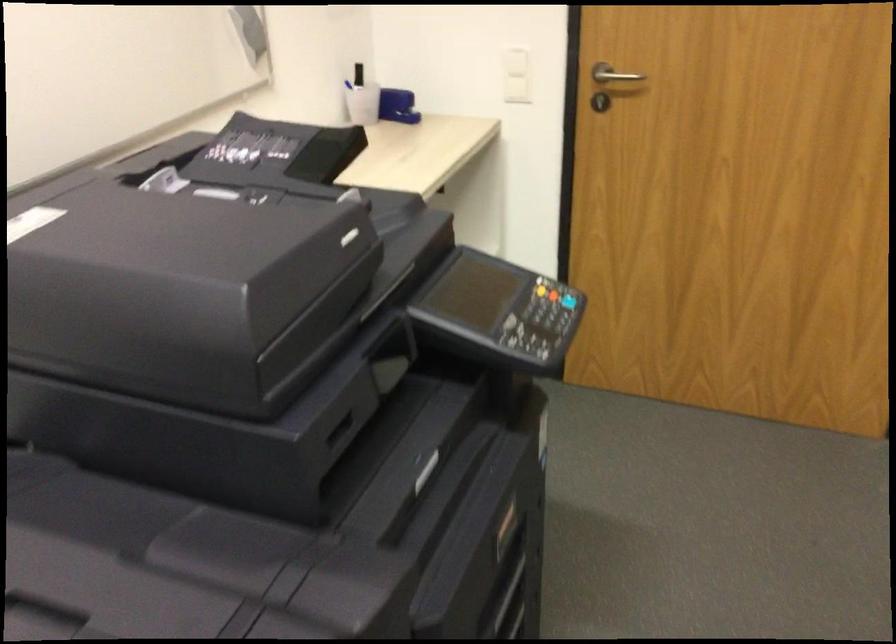
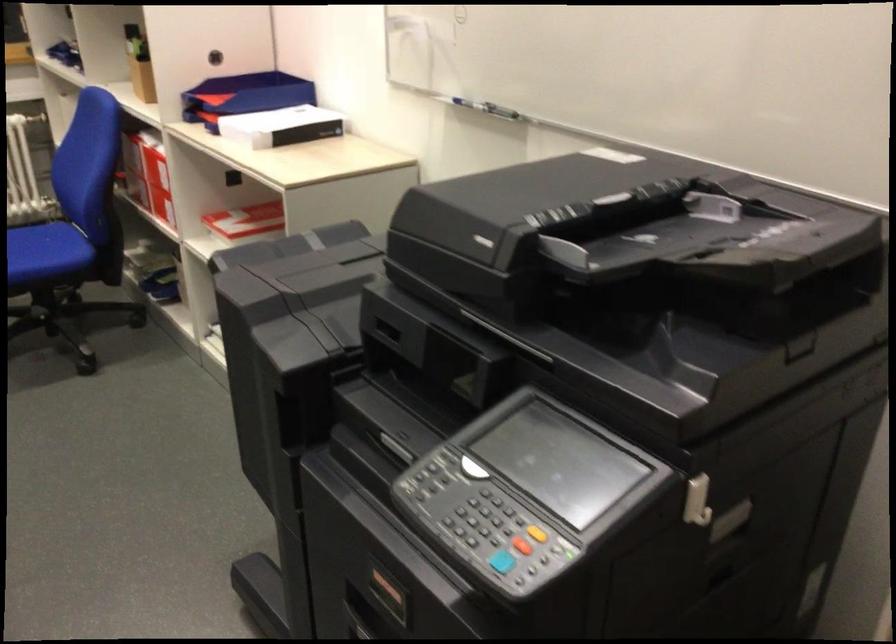
Where in the second image is the point corresponding to (x=565, y=335) from the first image?

(502, 562)